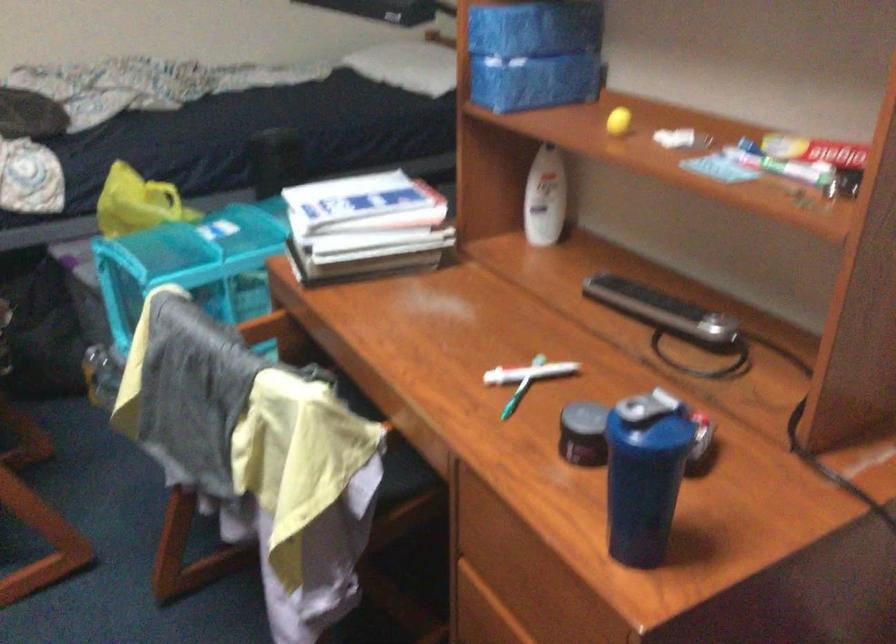
Describe the element at coordinates (584, 433) in the screenshot. I see `the black jar lid` at that location.